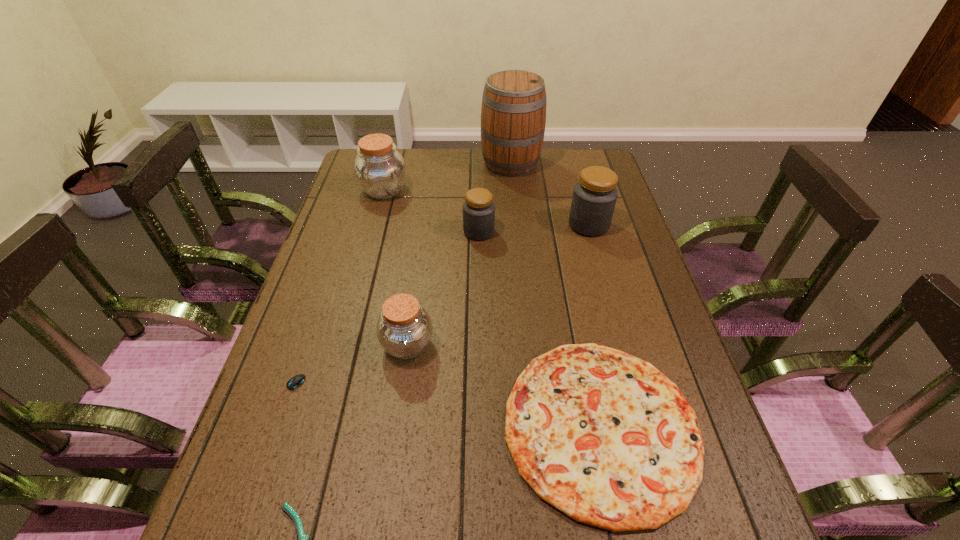
Locate an element on the screen. The height and width of the screenshot is (540, 960). cider is located at coordinates (513, 115).

Find the location of a particular element. The width and height of the screenshot is (960, 540). the bigger gray jar is located at coordinates (594, 198).

Identify the location of the right gray jar. The width and height of the screenshot is (960, 540). (594, 198).

The height and width of the screenshot is (540, 960). I want to click on the leftmost jar, so click(380, 170).

Identify the location of the left brown jar. (380, 170).

This screenshot has height=540, width=960. What are the coordinates of `the left gray jar` in the screenshot? It's located at (478, 209).

Identify the location of the smaller gray jar. The width and height of the screenshot is (960, 540). (478, 209).

In order to click on the nearer brown jar in this screenshot , I will do [x=404, y=329].

This screenshot has width=960, height=540. In order to click on the nearest jar in this screenshot , I will do `click(404, 329)`.

The height and width of the screenshot is (540, 960). Find the location of `the sixth tallest object`. the sixth tallest object is located at coordinates (603, 436).